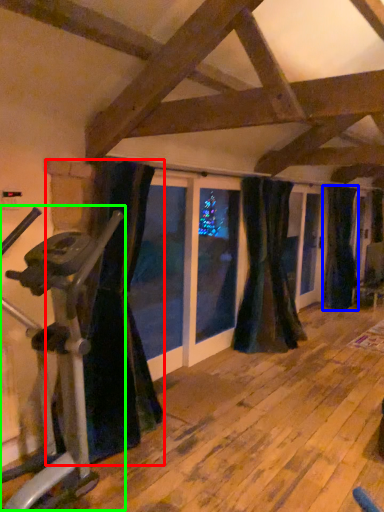
Question: Considering the real-world distances, which object is farthest from curtain (highlighted by a red box)? curtain (highlighted by a blue box) or stationary bicycle (highlighted by a green box)?

Choices:
 (A) curtain
 (B) stationary bicycle

Answer: (A)